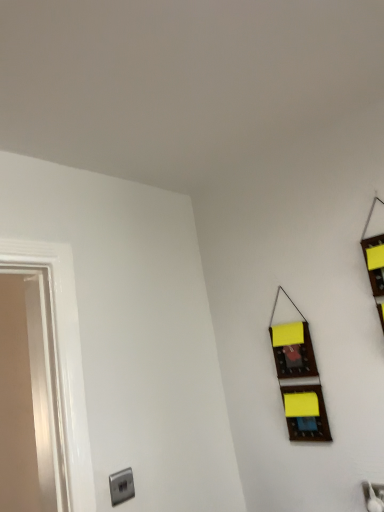
Measure the distance between satin silver outlet at lower left and camera.

satin silver outlet at lower left and camera are 4.09 feet apart from each other.

What is the approximate height of satin silver outlet at lower left?

satin silver outlet at lower left is 3.45 inches tall.

Image resolution: width=384 pixels, height=512 pixels. I want to click on satin silver outlet at lower left, so click(x=121, y=486).

The image size is (384, 512). What do you see at coordinates (121, 486) in the screenshot? I see `satin silver outlet at lower left` at bounding box center [121, 486].

What do you see at coordinates (299, 379) in the screenshot? This screenshot has height=512, width=384. I see `wooden organizer at right` at bounding box center [299, 379].

At what (x,y) coordinates should I click in order to perform the action: click on wooden organizer at right. Please return your answer as a coordinate pair (x, y). The image size is (384, 512). Looking at the image, I should click on (299, 379).

At what (x,y) coordinates should I click in order to perform the action: click on satin silver outlet at lower left. Please return your answer as a coordinate pair (x, y). Looking at the image, I should click on (121, 486).

Which object is positioned more to the left, wooden organizer at right or satin silver outlet at lower left?

Positioned to the left is satin silver outlet at lower left.

Looking at this image, is wooden organizer at right behind satin silver outlet at lower left?

Yes, wooden organizer at right is further from the camera.

Does point (309, 388) come behind point (125, 475)?

That is True.

From the image's perspective, which object appears higher, wooden organizer at right or satin silver outlet at lower left?

wooden organizer at right appears higher in the image.

From a real-world perspective, is wooden organizer at right positioned over satin silver outlet at lower left based on gravity?

Yes, from a real-world perspective, wooden organizer at right is over satin silver outlet at lower left

Considering the sizes of objects wooden organizer at right and satin silver outlet at lower left in the image provided, who is thinner, wooden organizer at right or satin silver outlet at lower left?

satin silver outlet at lower left.

Who is shorter, wooden organizer at right or satin silver outlet at lower left?

satin silver outlet at lower left is shorter.

Is wooden organizer at right bigger or smaller than satin silver outlet at lower left?

wooden organizer at right is bigger than satin silver outlet at lower left.

Can we say wooden organizer at right lies outside satin silver outlet at lower left?

Yes, wooden organizer at right is not within satin silver outlet at lower left.

Is wooden organizer at right placed right next to satin silver outlet at lower left?

No.

In the scene shown: Is wooden organizer at right aimed at satin silver outlet at lower left?

No, wooden organizer at right is not facing towards satin silver outlet at lower left.

The width and height of the screenshot is (384, 512). What are the coordinates of `window located above the satin silver outlet at lower left (from the image's perspective)` in the screenshot? It's located at (299, 379).

Is satin silver outlet at lower left to the right of wooden organizer at right from the viewer's perspective?

Incorrect, satin silver outlet at lower left is not on the right side of wooden organizer at right.

Is the depth of satin silver outlet at lower left less than that of wooden organizer at right?

That is True.

Which point is more distant from viewer, (129, 486) or (299, 419)?

The point (299, 419) is farther.

In the scene shown: From the image's perspective, is satin silver outlet at lower left on wooden organizer at right?

No, from the image's perspective, satin silver outlet at lower left is not on top of wooden organizer at right.

From a real-world perspective, is satin silver outlet at lower left physically located above or below wooden organizer at right?

Clearly, from a real-world perspective, satin silver outlet at lower left is below wooden organizer at right.

Does satin silver outlet at lower left have a greater width compared to wooden organizer at right?

No, satin silver outlet at lower left is not wider than wooden organizer at right.

Who is shorter, satin silver outlet at lower left or wooden organizer at right?

satin silver outlet at lower left.

Is satin silver outlet at lower left smaller than wooden organizer at right?

Indeed, satin silver outlet at lower left has a smaller size compared to wooden organizer at right.

Would you say satin silver outlet at lower left is outside wooden organizer at right?

satin silver outlet at lower left is positioned outside wooden organizer at right.

Is satin silver outlet at lower left beside wooden organizer at right?

No, satin silver outlet at lower left is not with wooden organizer at right.

Could you tell me if satin silver outlet at lower left is turned towards wooden organizer at right?

No, satin silver outlet at lower left is not turned towards wooden organizer at right.

What's the angular difference between satin silver outlet at lower left and wooden organizer at right's facing directions?

The angle between the facing direction of satin silver outlet at lower left and the facing direction of wooden organizer at right is 88.4 degrees.

Where is `electric outlet in front of the wooden organizer at right`? The width and height of the screenshot is (384, 512). electric outlet in front of the wooden organizer at right is located at coordinates (121, 486).

This screenshot has width=384, height=512. Identify the location of electric outlet that is under the wooden organizer at right (from a real-world perspective). [121, 486].

I want to click on electric outlet in front of the wooden organizer at right, so click(x=121, y=486).